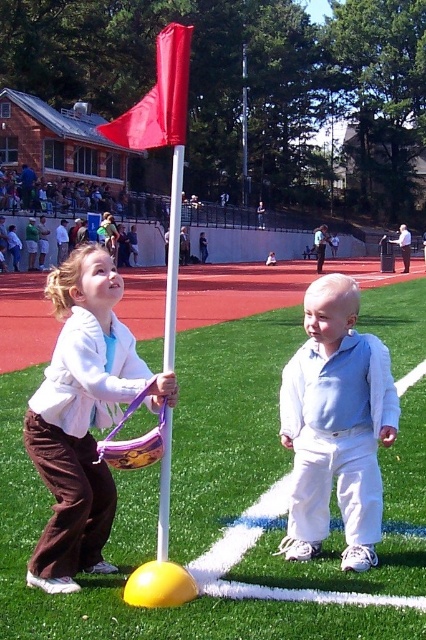
Question: In this image, where is matte yellow base at center located relative to red fabric flagpole at center?

Choices:
 (A) above
 (B) below

Answer: (B)

Question: Can you confirm if matte brown pants at lower left is bigger than light blue cotton shirt at center?

Choices:
 (A) no
 (B) yes

Answer: (A)

Question: Estimate the real-world distances between objects in this image. Which object is farther from the red fabric flagpole at center?

Choices:
 (A) matte brown pants at lower left
 (B) matte yellow base at center

Answer: (A)

Question: Considering the relative positions of light blue cotton shirt at center and red fabric flagpole at center in the image provided, where is light blue cotton shirt at center located with respect to red fabric flagpole at center?

Choices:
 (A) above
 (B) below

Answer: (B)

Question: Which point appears farthest from the camera in this image?

Choices:
 (A) click(x=112, y=380)
 (B) click(x=333, y=326)
 (C) click(x=396, y=358)
 (D) click(x=167, y=76)

Answer: (C)

Question: Which of these objects is positioned closest to the light blue cotton shirt at center?

Choices:
 (A) red fabric flag at upper center
 (B) matte brown pants at lower left

Answer: (B)